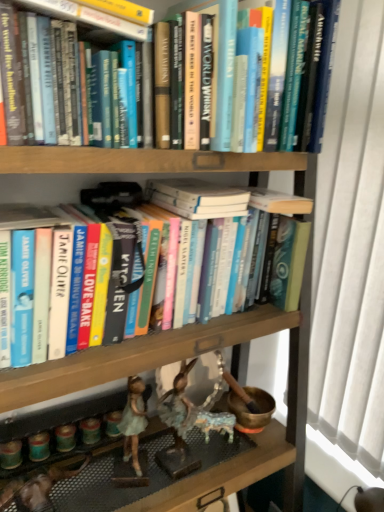
Question: Considering the relative sizes of matte green figurine at lower left and hardcover book at upper center, arranged as the third book when ordered from the bottom, in the image provided, is matte green figurine at lower left bigger than hardcover book at upper center, arranged as the third book when ordered from the bottom,?

Choices:
 (A) no
 (B) yes

Answer: (A)

Question: Can you confirm if matte green figurine at lower left is thinner than hardcover book at upper center, arranged as the third book when ordered from the bottom?

Choices:
 (A) no
 (B) yes

Answer: (B)

Question: From the image's perspective, is matte green figurine at lower left on top of hardcover book at upper center, arranged as the third book when ordered from the bottom?

Choices:
 (A) no
 (B) yes

Answer: (A)

Question: Is matte green figurine at lower left further to the viewer compared to hardcover book at upper center, which is counted as the first book, starting from the top?

Choices:
 (A) yes
 (B) no

Answer: (A)

Question: Is matte green figurine at lower left not within hardcover book at upper center, which is counted as the first book, starting from the top?

Choices:
 (A) no
 (B) yes

Answer: (B)

Question: From the image's perspective, is matte green figurine at lower left beneath hardcover book at upper center, arranged as the third book when ordered from the bottom?

Choices:
 (A) no
 (B) yes

Answer: (B)

Question: Could hardcover book at center, the first book from the bottom, be considered to be inside hardcover book at upper center, which appears as the 2th book when ordered from the bottom?

Choices:
 (A) no
 (B) yes

Answer: (A)

Question: Considering the relative sizes of hardcover book at upper center, which appears as the 2th book when ordered from the bottom, and hardcover book at center, the first book from the bottom, in the image provided, is hardcover book at upper center, which appears as the 2th book when ordered from the bottom, thinner than hardcover book at center, the first book from the bottom,?

Choices:
 (A) yes
 (B) no

Answer: (A)

Question: From the image's perspective, would you say hardcover book at upper center, which appears as the 2th book when ordered from the bottom, is positioned over hardcover book at center, the first book from the bottom?

Choices:
 (A) yes
 (B) no

Answer: (A)

Question: Is hardcover book at upper center, which appears as the 2th book when ordered from the bottom, touching hardcover book at center, which is counted as the third book, starting from the top?

Choices:
 (A) yes
 (B) no

Answer: (B)

Question: From a real-world perspective, does hardcover book at upper center, the second book positioned from the top, stand above hardcover book at center, which is counted as the third book, starting from the top?

Choices:
 (A) no
 (B) yes

Answer: (B)

Question: Is hardcover book at upper center, the second book positioned from the top, closer to camera compared to hardcover book at center, the first book from the bottom?

Choices:
 (A) yes
 (B) no

Answer: (B)

Question: Is hardcover book at upper center, which appears as the 2th book when ordered from the bottom, behind hardcover book at upper center, arranged as the third book when ordered from the bottom?

Choices:
 (A) yes
 (B) no

Answer: (A)